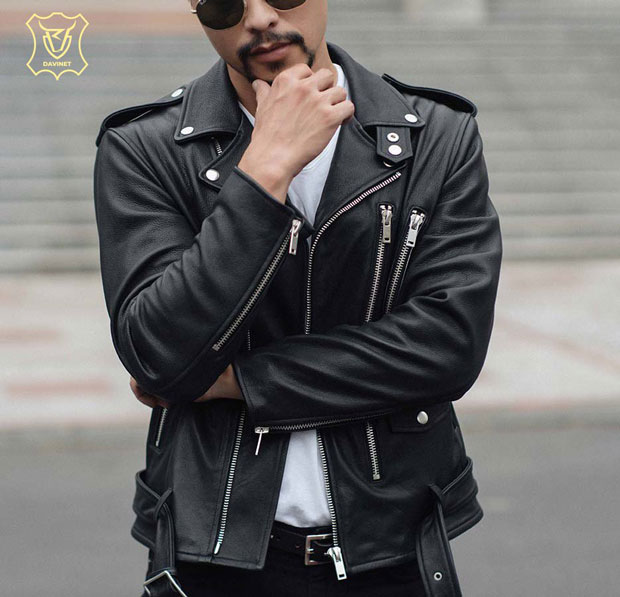
At what (x,y) coordinates should I click in order to perform the action: click on wall. Please return your answer as a coordinate pair (x, y). Looking at the image, I should click on (521, 96).